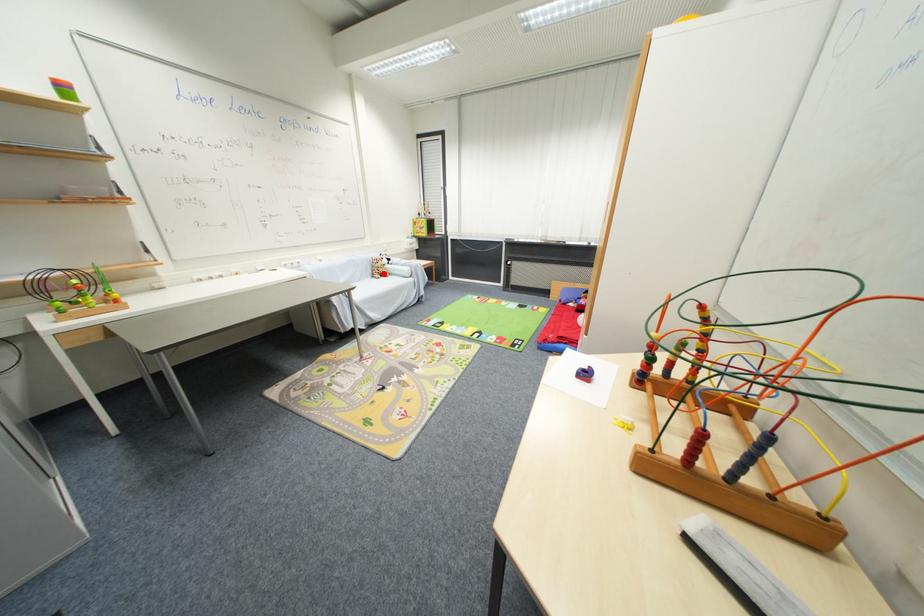
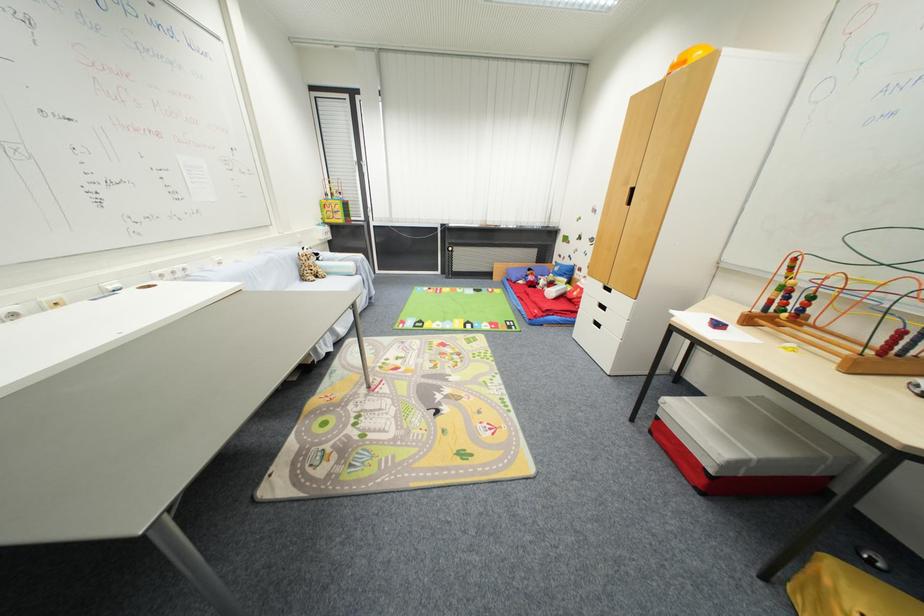
Question: I am providing you with two images of the same scene from different viewpoints. A red point is shown in image1. For the corresponding object point in image2, is it positioned nearer or farther from the camera?

Choices:
 (A) Nearer
 (B) Farther

Answer: (B)